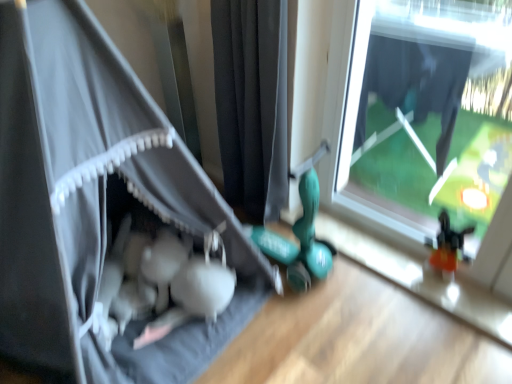
Question: Is black fabric curtain at center, which is counted as the 1th curtain, starting from the right, located outside matte gray tent at left, marked as the 2th curtain in a right-to-left arrangement?

Choices:
 (A) no
 (B) yes

Answer: (B)

Question: From a real-world perspective, is black fabric curtain at center, which appears as the second curtain when viewed from the left, located higher than matte gray tent at left, marked as the 2th curtain in a right-to-left arrangement?

Choices:
 (A) no
 (B) yes

Answer: (A)

Question: From the image's perspective, is black fabric curtain at center, which is counted as the 1th curtain, starting from the right, beneath matte gray tent at left, marked as the 2th curtain in a right-to-left arrangement?

Choices:
 (A) no
 (B) yes

Answer: (A)

Question: Is black fabric curtain at center, which appears as the second curtain when viewed from the left, to the left of matte gray tent at left, acting as the 1th curtain starting from the left, from the viewer's perspective?

Choices:
 (A) yes
 (B) no

Answer: (B)

Question: Is the depth of black fabric curtain at center, which is counted as the 1th curtain, starting from the right, greater than that of matte gray tent at left, acting as the 1th curtain starting from the left?

Choices:
 (A) yes
 (B) no

Answer: (A)

Question: Can we say transparent glass window at center lies outside matte gray tent at left, marked as the 2th curtain in a right-to-left arrangement?

Choices:
 (A) yes
 (B) no

Answer: (A)

Question: Considering the relative positions of transparent glass window at center and matte gray tent at left, acting as the 1th curtain starting from the left, in the image provided, is transparent glass window at center to the right of matte gray tent at left, acting as the 1th curtain starting from the left, from the viewer's perspective?

Choices:
 (A) yes
 (B) no

Answer: (A)

Question: Is transparent glass window at center taller than matte gray tent at left, marked as the 2th curtain in a right-to-left arrangement?

Choices:
 (A) yes
 (B) no

Answer: (B)

Question: From the image's perspective, is transparent glass window at center over matte gray tent at left, acting as the 1th curtain starting from the left?

Choices:
 (A) no
 (B) yes

Answer: (B)

Question: Is transparent glass window at center to the left of matte gray tent at left, acting as the 1th curtain starting from the left, from the viewer's perspective?

Choices:
 (A) yes
 (B) no

Answer: (B)

Question: Are transparent glass window at center and matte gray tent at left, acting as the 1th curtain starting from the left, beside each other?

Choices:
 (A) yes
 (B) no

Answer: (B)

Question: From a real-world perspective, is transparent glass window at center over black fabric curtain at center, which appears as the second curtain when viewed from the left?

Choices:
 (A) no
 (B) yes

Answer: (B)